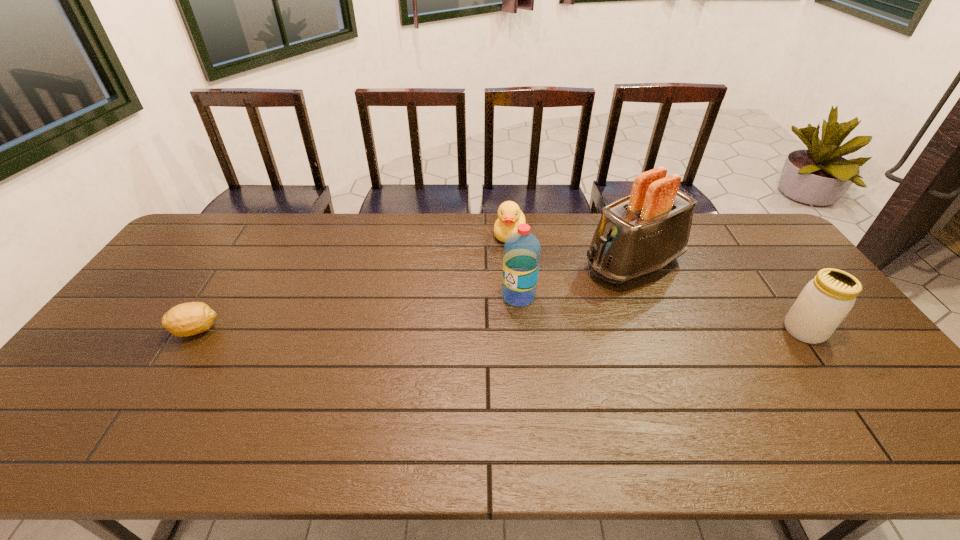
Where is `unoccupied area between the shortest object and the fourth shortest object`? The image size is (960, 540). unoccupied area between the shortest object and the fourth shortest object is located at coordinates (358, 313).

Locate an element on the screen. The height and width of the screenshot is (540, 960). unoccupied area between the third shortest object and the toaster is located at coordinates (718, 297).

Where is `free space between the lemon and the rightmost object`? The image size is (960, 540). free space between the lemon and the rightmost object is located at coordinates (500, 330).

The width and height of the screenshot is (960, 540). Find the location of `empty location between the rightmost object and the second shortest object`. empty location between the rightmost object and the second shortest object is located at coordinates (657, 283).

Find the location of a particular element. vacant region between the fourth object from left to right and the jar is located at coordinates (718, 297).

Find the location of a particular element. The height and width of the screenshot is (540, 960). free space between the fourth object from left to right and the water bottle is located at coordinates (576, 280).

Where is `vacant region between the second shortest object and the leftmost object`? This screenshot has width=960, height=540. vacant region between the second shortest object and the leftmost object is located at coordinates (353, 282).

Choose which object is the nearest neighbor to the third tallest object. Please provide its 2D coordinates. Your answer should be formatted as a tuple, i.e. [(x, y)], where the tuple contains the x and y coordinates of a point satisfying the conditions above.

[(639, 234)]

Find the location of a particular element. object that is the closest to the water bottle is located at coordinates (639, 234).

The width and height of the screenshot is (960, 540). I want to click on free location that satisfies the following two spatial constraints: 1. on the front side of the third shortest object; 2. on the left side of the water bottle, so click(x=521, y=330).